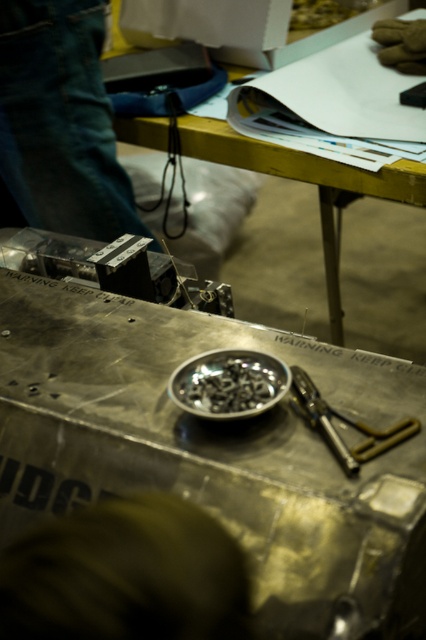
You are a maintenance worker needing to reach both the metallic yellow table at upper center and the metallic silver pliers at center. If you are standing at the center of the workbench, which object is closer to you?

Result: The metallic silver pliers at center are closer to you since you are standing at the center of the workbench, and the pliers are already at the center. The metallic yellow table at upper center is 4.02 feet away from the pliers, meaning it is farther away from your current position.

You are a safety inspector checking the workbench. You notice the brown fuzzy hair at lower center and the metallic silver screws at center. According to safety protocols, which object should be removed first due to its height posing a tripping hazard?

The brown fuzzy hair at lower center should be removed first because it has a greater height compared to the metallic silver screws at center, making it a higher tripping hazard.

In the scene shown: You are standing at the point marked as point (215, 442) in the image. What object is located exactly at that point?

The metallic silver table at center is located exactly at point (215, 442).